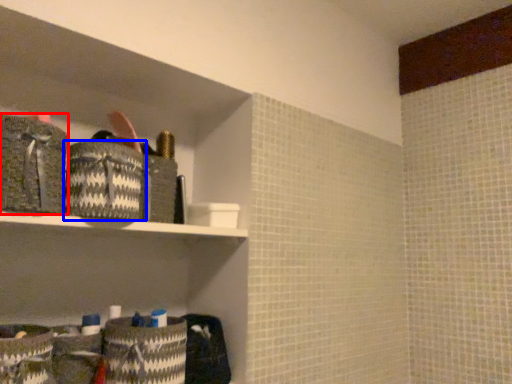
Question: Which point is further to the camera, material (highlighted by a red box) or material (highlighted by a blue box)?

Choices:
 (A) material
 (B) material

Answer: (B)